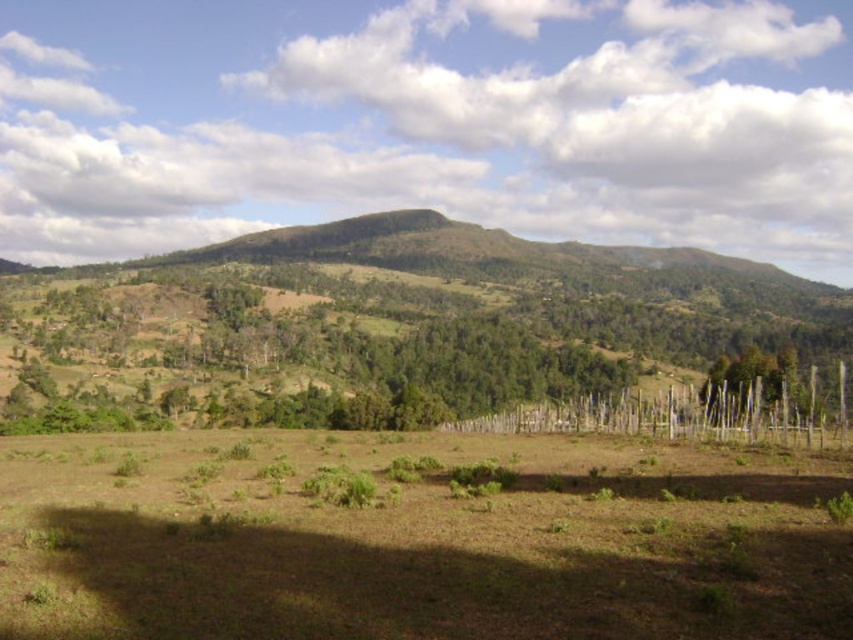
Based on the scene described, which object takes up more area in the image? Please consider the brown grassy field at center and the green leafy trees at left in your answer.

The green leafy trees at left occupy more space than the brown grassy field at center in the image.

You are a farmer planning to install a new irrigation system. You need to decide whether to place the system closer to the green leafy trees at left or the green wood fence at right. Considering their sizes, which area would require more water and thus be better suited for the irrigation system?

The green leafy trees at left are bigger than the green wood fence at right, so they would require more water. Therefore, the irrigation system should be placed closer to the green leafy trees at left.